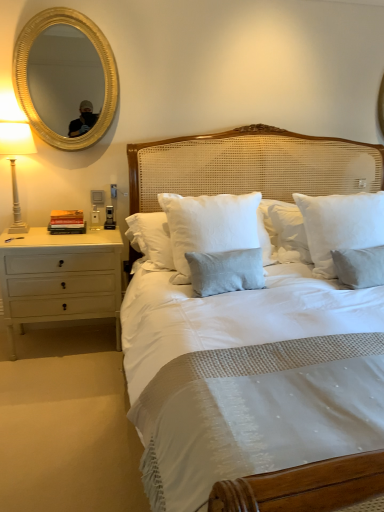
Question: Visually, is gold metallic mirror at upper left positioned to the left or to the right of white ceramic lamp at left?

Choices:
 (A) left
 (B) right

Answer: (B)

Question: Does point (94, 69) appear closer or farther from the camera than point (1, 151)?

Choices:
 (A) closer
 (B) farther

Answer: (B)

Question: Based on their relative distances, which object is farther from the gold metallic mirror at upper left?

Choices:
 (A) white cotton pillow at center, marked as the 1th pillow in a right-to-left arrangement
 (B) white ceramic lamp at left
 (C) white cotton pillow at center, marked as the 1th pillow in a left-to-right arrangement
 (D) white wood nightstand at left

Answer: (A)

Question: Which is nearer to the gold metallic mirror at upper left?

Choices:
 (A) white ceramic lamp at left
 (B) white cotton pillow at center, marked as the 1th pillow in a left-to-right arrangement
 (C) white wood nightstand at left
 (D) white cotton pillow at center, the 2th pillow viewed from the left

Answer: (A)